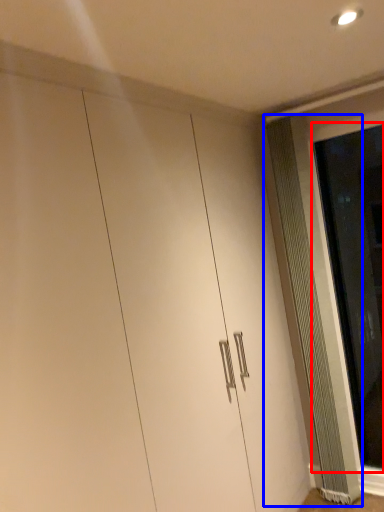
Question: Which of the following is the closest to the observer, screen door (highlighted by a red box) or radiator (highlighted by a blue box)?

Choices:
 (A) screen door
 (B) radiator

Answer: (A)